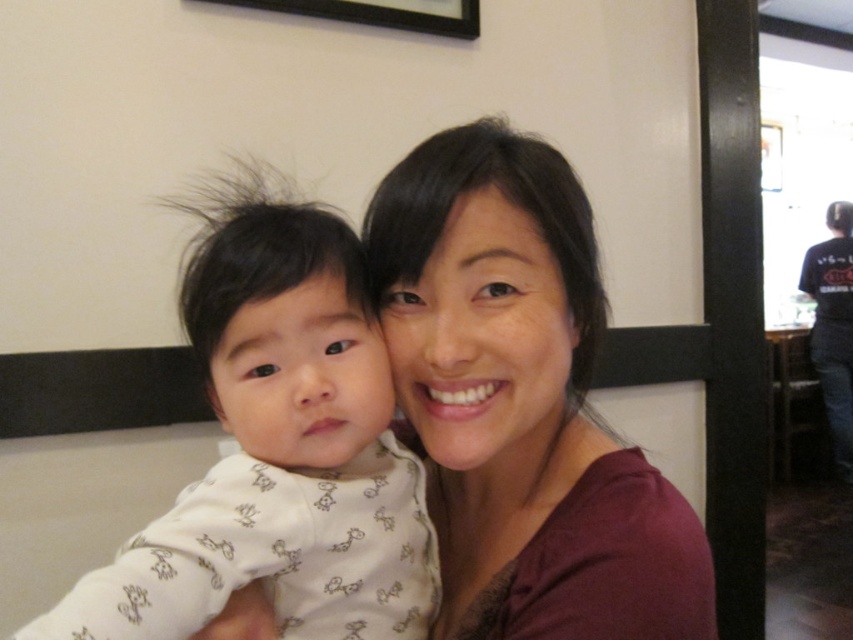
Based on the photo, you are a photographer setting up for a family portrait. You need to ensure that both the matte maroon shirt at center and the white soft fabric baby at left are clearly visible in the frame. Given their sizes, which object should you focus on first to ensure proper exposure?

The matte maroon shirt at center is larger than the white soft fabric baby at left, so you should focus on the matte maroon shirt at center first to ensure proper exposure.

You are standing in a room and see the matte maroon shirt at center and the black matte picture frame at upper center. Which object is positioned higher in the image?

The black matte picture frame at upper center is positioned higher than the matte maroon shirt at center.